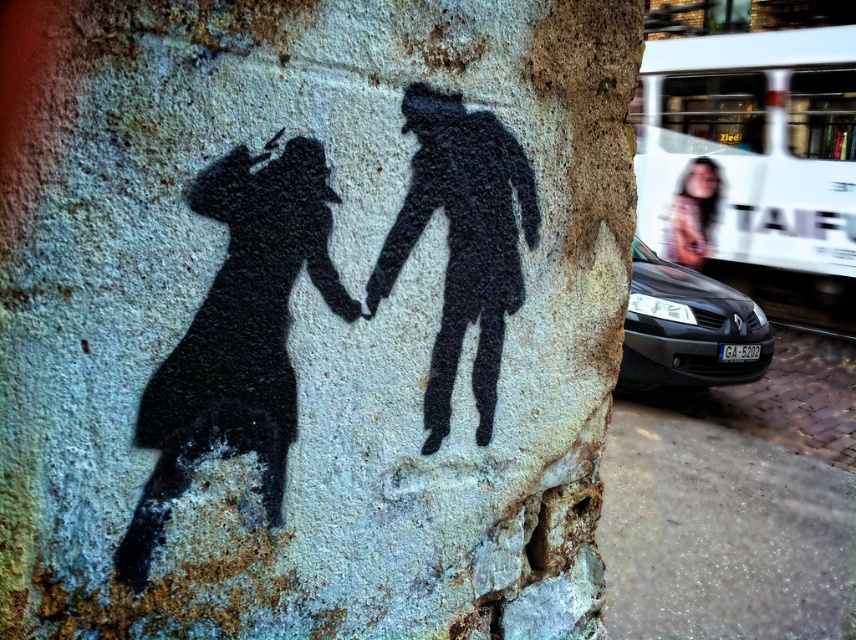
Question: Does black textured shadow at center have a larger size compared to smooth skin face at upper right?

Choices:
 (A) no
 (B) yes

Answer: (B)

Question: Which object is positioned closest to the smooth skin face at upper right?

Choices:
 (A) black textured shadow at center
 (B) black matte silhouette at center
 (C) black matte car at lower right

Answer: (C)

Question: Which point is closer to the camera?

Choices:
 (A) black textured shadow at center
 (B) black matte car at lower right
 (C) smooth skin face at upper right

Answer: (A)

Question: Which object is the closest to the black matte silhouette at center?

Choices:
 (A) black matte car at lower right
 (B) black textured shadow at center

Answer: (B)

Question: Does black textured shadow at center have a larger size compared to smooth skin face at upper right?

Choices:
 (A) no
 (B) yes

Answer: (B)

Question: Is black matte silhouette at center wider than black matte car at lower right?

Choices:
 (A) yes
 (B) no

Answer: (B)